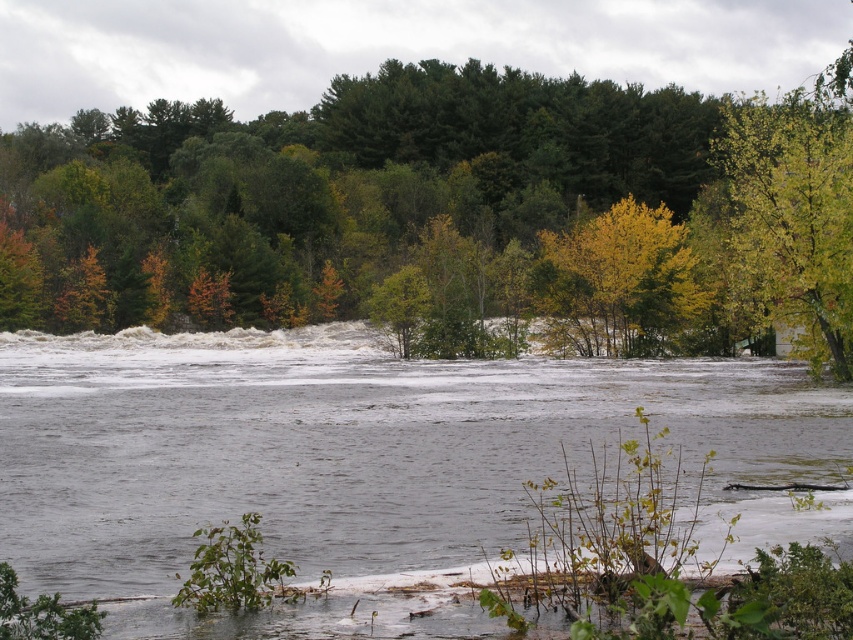
Is point (465, 240) farther from camera compared to point (605, 304)?

That is True.

From the picture: Can you confirm if green leafy tree at center is taller than yellow leafy tree at center?

Yes.

Which is behind, point (643, 198) or point (590, 326)?

Point (643, 198)

Locate an element on the screen. green leafy tree at center is located at coordinates (447, 214).

Who is shorter, gray water at center or yellow-green leaves at upper right?

gray water at center is shorter.

Is gray water at center positioned behind yellow-green leaves at upper right?

No, it is not.

Is point (477, 378) positioned before point (772, 156)?

Yes.

You are a GUI agent. You are given a task and a screenshot of the screen. Output one action in this format:
    pyautogui.click(x=<x>, y=<y>)
    Task: Click on the gray water at center
    This screenshot has height=640, width=853.
    Given the screenshot: What is the action you would take?
    360,460

Which is in front, point (309, 541) or point (601, 275)?

Point (309, 541) is more forward.

Does gray water at center have a greater height compared to yellow leafy tree at center?

No, gray water at center is not taller than yellow leafy tree at center.

Who is more forward, (814,388) or (641,250)?

Point (814,388)

Find the location of a particular element. The height and width of the screenshot is (640, 853). gray water at center is located at coordinates (360, 460).